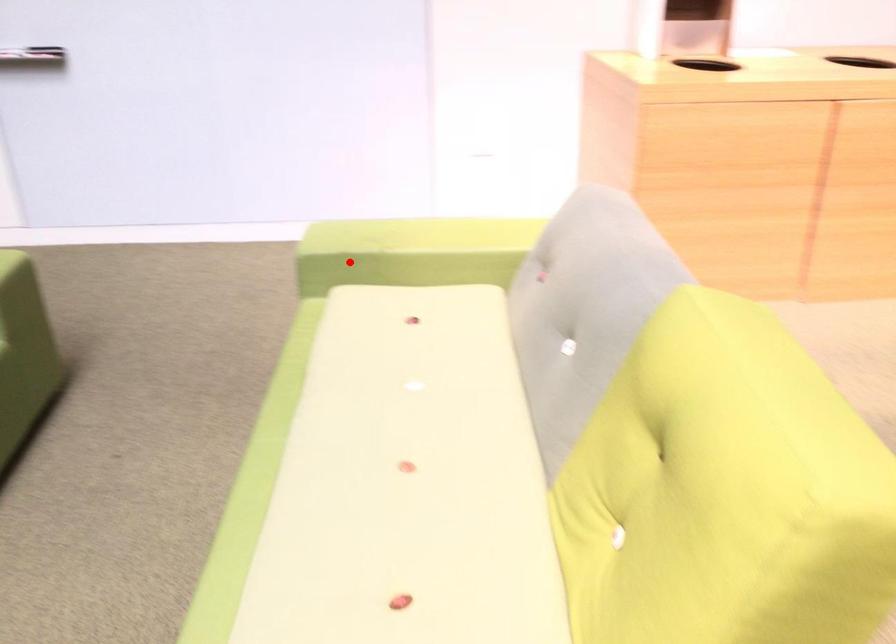
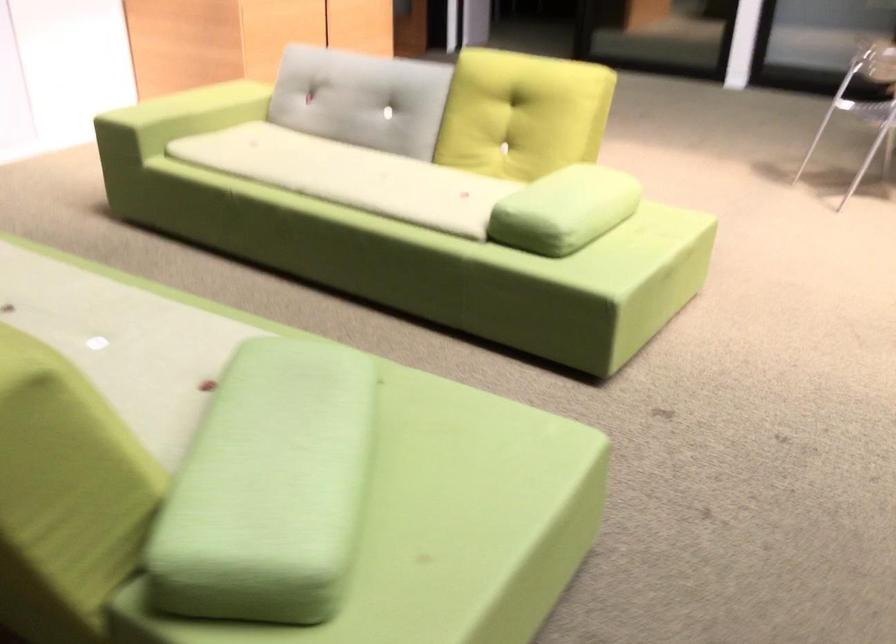
Question: I am providing you with two images of the same scene from different viewpoints. Given a red point in image1, look at the same physical point in image2. Is it:

Choices:
 (A) Closer to the viewpoint
 (B) Farther from the viewpoint

Answer: (B)